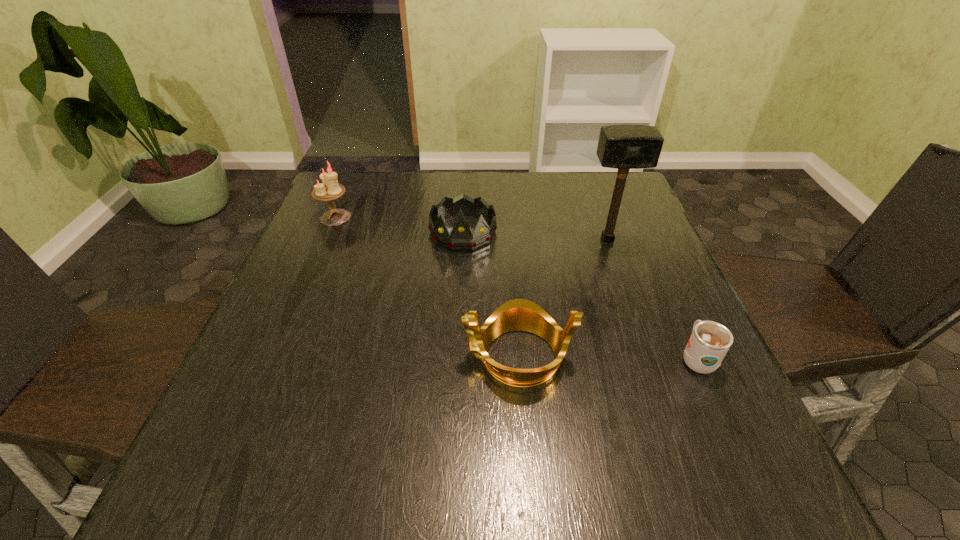
Find the location of `vacant position in the image that satisfies the following two spatial constraints: 1. at the front emblem of the nearer tiara; 2. on the side with the handle of the cup`. vacant position in the image that satisfies the following two spatial constraints: 1. at the front emblem of the nearer tiara; 2. on the side with the handle of the cup is located at coordinates tap(518, 359).

The height and width of the screenshot is (540, 960). In order to click on vacant region that satisfies the following two spatial constraints: 1. on the side with the handle of the cup; 2. at the front emblem of the nearer tiara in this screenshot , I will do `click(695, 356)`.